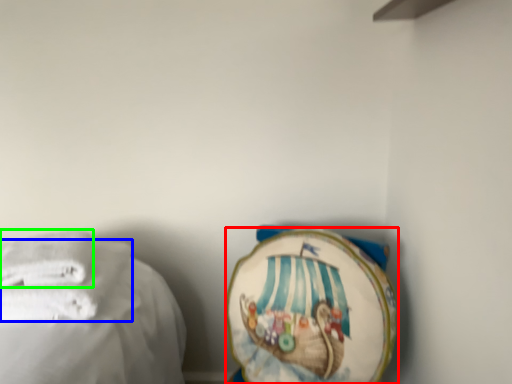
Question: Based on their relative distances, which object is nearer to towel (highlighted by a red box)? Choose from towel (highlighted by a blue box) and towel (highlighted by a green box).

Choices:
 (A) towel
 (B) towel

Answer: (A)